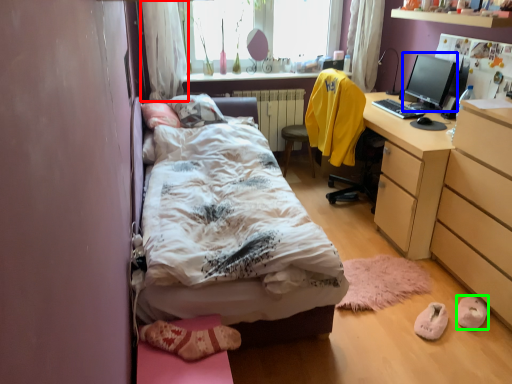
Question: Which object is the farthest from curtain (highlighted by a red box)? Choose among these: computer monitor (highlighted by a blue box) or shoe (highlighted by a green box).

Choices:
 (A) computer monitor
 (B) shoe

Answer: (B)